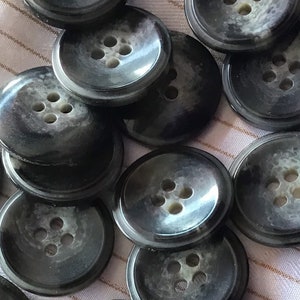
I want to click on fabric, so click(x=281, y=258).